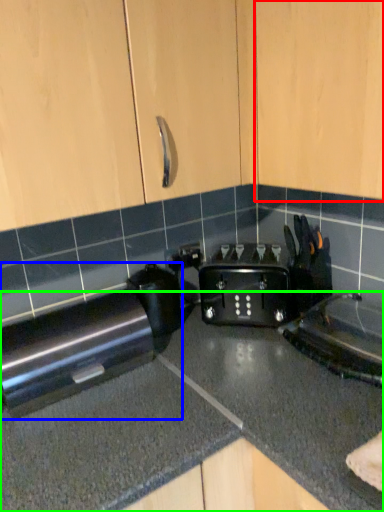
Question: Which object is positioned closest to cabinetry (highlighted by a red box)? Select from home appliance (highlighted by a blue box) and countertop (highlighted by a green box).

Choices:
 (A) home appliance
 (B) countertop

Answer: (B)